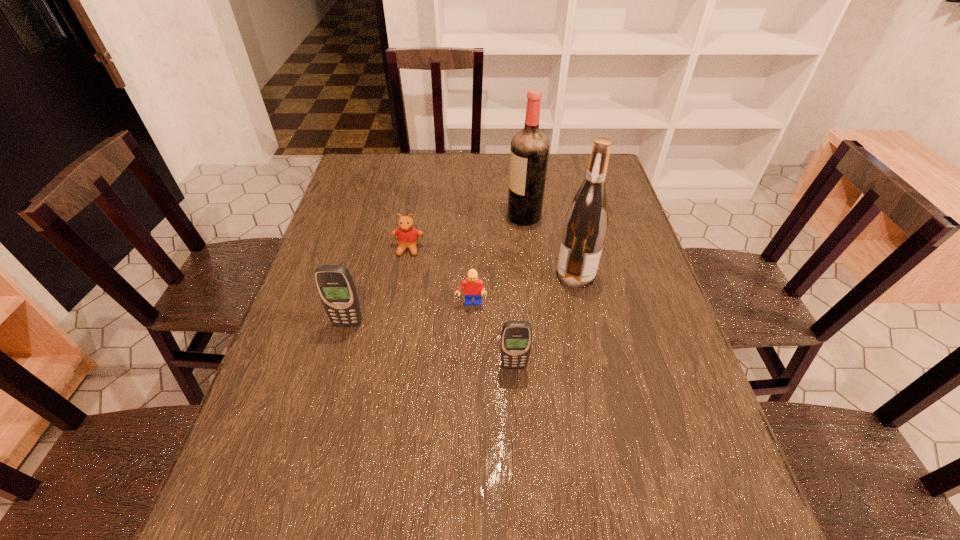
Find the location of a particular element. object that is at the right edge is located at coordinates (586, 222).

The width and height of the screenshot is (960, 540). In order to click on free space at the near edge in this screenshot , I will do `click(336, 442)`.

This screenshot has height=540, width=960. In the image, there is a desktop. Identify the location of vacant space at the left edge. (302, 295).

The image size is (960, 540). I want to click on blank space at the right edge, so click(x=643, y=267).

I want to click on vacant space at the far left corner, so click(x=350, y=164).

The height and width of the screenshot is (540, 960). What are the coordinates of `unoccupied position between the wine bottle and the farthest object` in the screenshot? It's located at (550, 246).

In order to click on vacant point located between the second object from left to right and the liquor in this screenshot , I will do [x=467, y=233].

This screenshot has height=540, width=960. What are the coordinates of `vacant area that lies between the leftmost object and the wine bottle` in the screenshot? It's located at (462, 299).

At what (x,y) coordinates should I click in order to perform the action: click on vacant region between the fifth nearest object and the third farthest object. Please return your answer as a coordinate pair (x, y). Image resolution: width=960 pixels, height=540 pixels. Looking at the image, I should click on (492, 261).

Find the location of `unoccupied position between the fourth nearest object and the Lego`. unoccupied position between the fourth nearest object and the Lego is located at coordinates (523, 289).